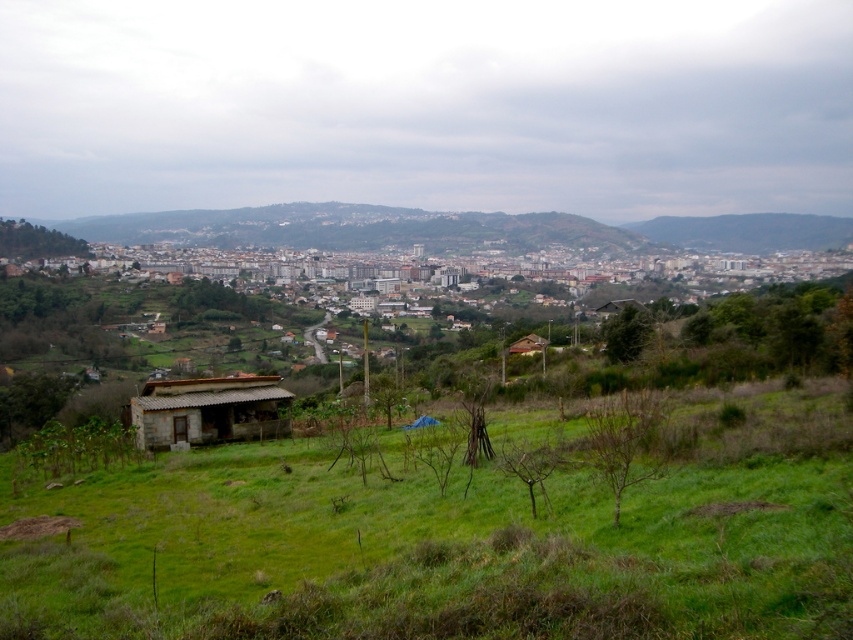
Question: Which point is farther to the camera?

Choices:
 (A) (523, 339)
 (B) (363, 588)
 (C) (177, 410)

Answer: (A)

Question: Is green grassy field at lower center to the right of rustic stone hut at lower left from the viewer's perspective?

Choices:
 (A) no
 (B) yes

Answer: (B)

Question: Which object is farther from the camera taking this photo?

Choices:
 (A) brown wooden hut at center
 (B) rustic stone hut at lower left
 (C) green grassy field at lower center

Answer: (A)

Question: Does green grassy field at lower center come behind brown wooden hut at center?

Choices:
 (A) yes
 (B) no

Answer: (B)

Question: Does green grassy field at lower center have a greater width compared to brown wooden hut at center?

Choices:
 (A) yes
 (B) no

Answer: (A)

Question: Estimate the real-world distances between objects in this image. Which object is farther from the brown wooden hut at center?

Choices:
 (A) rustic stone hut at lower left
 (B) green grassy field at lower center

Answer: (B)